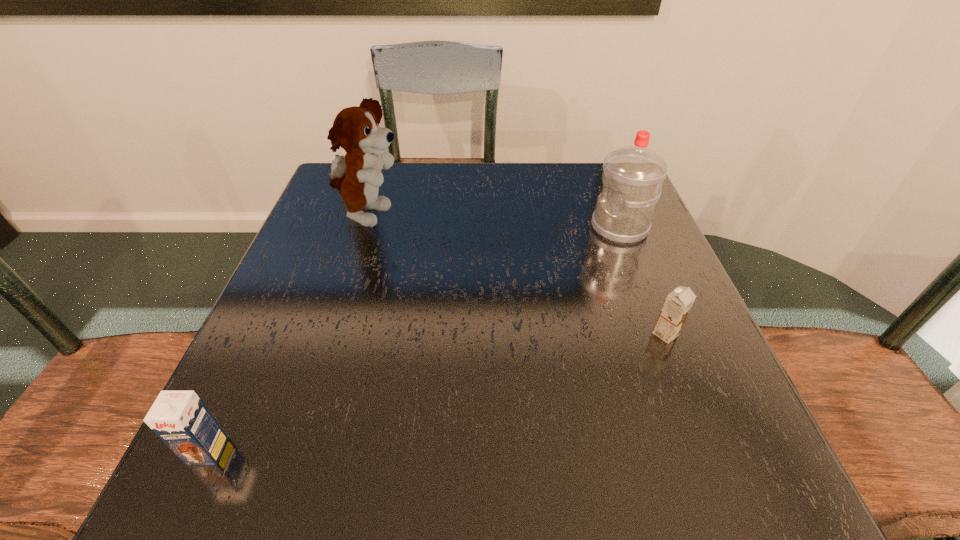
Find the location of a particular element. Image resolution: width=960 pixels, height=540 pixels. free space located on the left of the farther chocolate milk is located at coordinates (585, 334).

This screenshot has width=960, height=540. Find the location of `puppy positioned at the far edge`. puppy positioned at the far edge is located at coordinates (357, 175).

Locate an element on the screen. water bottle that is at the far edge is located at coordinates (632, 177).

Image resolution: width=960 pixels, height=540 pixels. Identify the location of object that is positioned at the near edge. (181, 420).

Identify the location of puppy situated at the left edge. (357, 175).

In order to click on chocolate milk that is at the left edge in this screenshot , I will do `click(181, 420)`.

Locate an element on the screen. This screenshot has width=960, height=540. water bottle that is at the right edge is located at coordinates (632, 177).

This screenshot has width=960, height=540. Identify the location of chocolate milk located in the right edge section of the desktop. (676, 308).

Find the location of a particular element. object positioned at the far left corner is located at coordinates (357, 175).

The image size is (960, 540). Find the location of `object that is positioned at the near left corner`. object that is positioned at the near left corner is located at coordinates (181, 420).